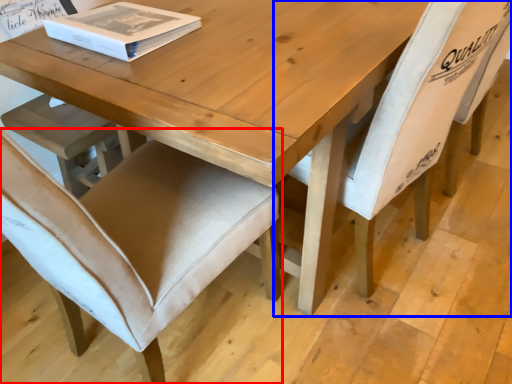
Question: Which of the following is the farthest to the observer, chair (highlighted by a red box) or chair (highlighted by a blue box)?

Choices:
 (A) chair
 (B) chair

Answer: (B)